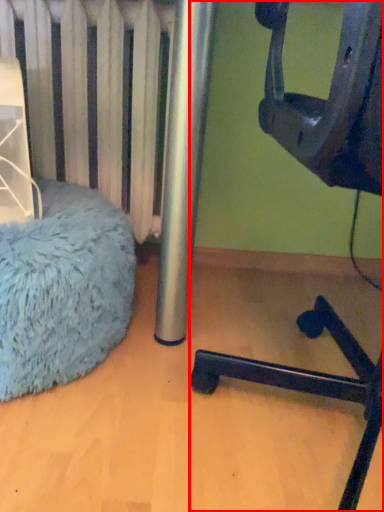
Question: From the image's perspective, where is furniture (annotated by the red box) located in relation to bean bag chair in the image?

Choices:
 (A) below
 (B) above

Answer: (B)